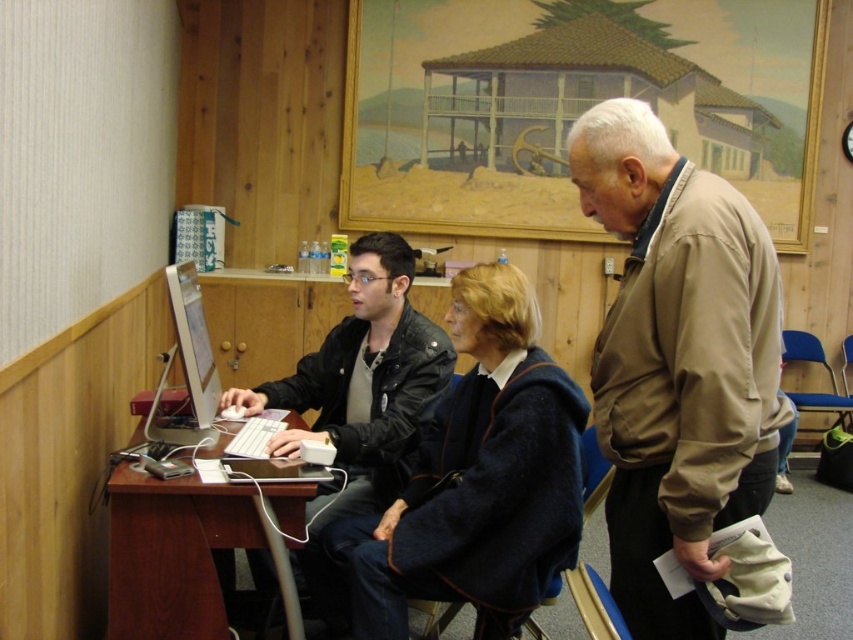
Question: In this image, where is brown wooden table at lower left located relative to matte plastic monitor at center left?

Choices:
 (A) above
 (B) below

Answer: (B)

Question: Is brown wooden table at lower left to the right of matte plastic monitor at center left from the viewer's perspective?

Choices:
 (A) no
 (B) yes

Answer: (B)

Question: Based on their relative distances, which object is farther from the black leather jacket at center?

Choices:
 (A) brown wooden table at lower left
 (B) brown cotton jacket at right
 (C) navy blue sweater at center

Answer: (B)

Question: Which point is closer to the camera?

Choices:
 (A) (508, 428)
 (B) (207, 422)
 (C) (227, 636)

Answer: (A)

Question: Observing the image, what is the correct spatial positioning of brown cotton jacket at right in reference to navy blue sweater at center?

Choices:
 (A) below
 (B) above

Answer: (B)

Question: Estimate the real-world distances between objects in this image. Which object is closer to the black leather jacket at center?

Choices:
 (A) brown cotton jacket at right
 (B) matte plastic monitor at center left
 (C) brown wooden table at lower left

Answer: (C)